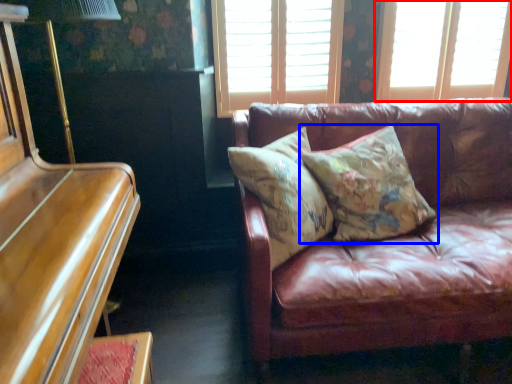
Question: Which object is closer to the camera taking this photo, window (highlighted by a red box) or pillow (highlighted by a blue box)?

Choices:
 (A) window
 (B) pillow

Answer: (B)